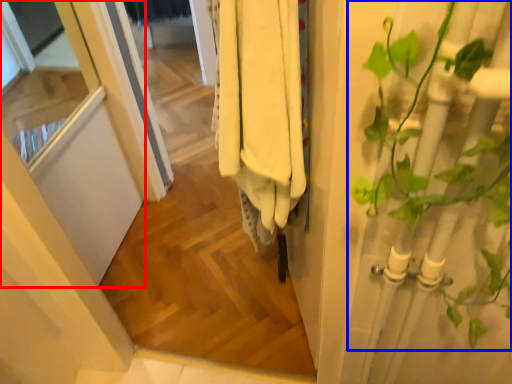
Question: Which of the following is the farthest to the observer, screen door (highlighted by a red box) or houseplant (highlighted by a blue box)?

Choices:
 (A) screen door
 (B) houseplant

Answer: (A)